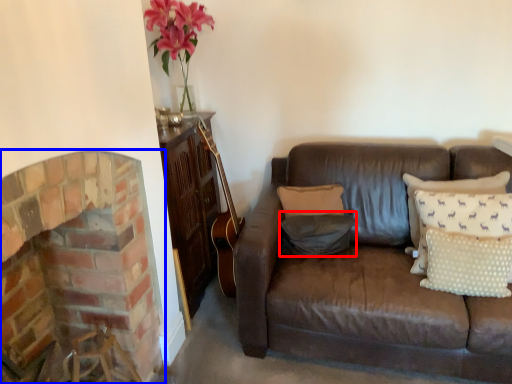
Question: Which object appears farthest to the camera in this image, pillow (highlighted by a red box) or fireplace (highlighted by a blue box)?

Choices:
 (A) pillow
 (B) fireplace

Answer: (A)